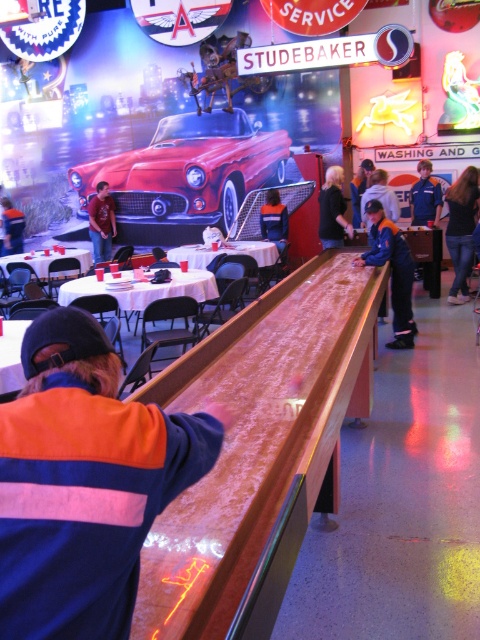
You are a photographer standing at the camera position in the scene. You want to take a closeup of the blue denim jacket at center. Is the jacket within your camera lens range? Assume your camera can focus on objects up to 5 meters away.

The blue denim jacket at center is 7.63 meters away from camera, which is beyond the camera lens range of 5 meters. Therefore, the jacket cannot be captured in a closeup.

You are a customer at this retro diner and notice two jackets hanging on a rack near the shuffleboard table. The jackets are the blue denim jacket at center and the orange fabric jacket at center. Which jacket is positioned higher on the rack?

The blue denim jacket at center is located above the orange fabric jacket at center, so it is positioned higher on the rack.